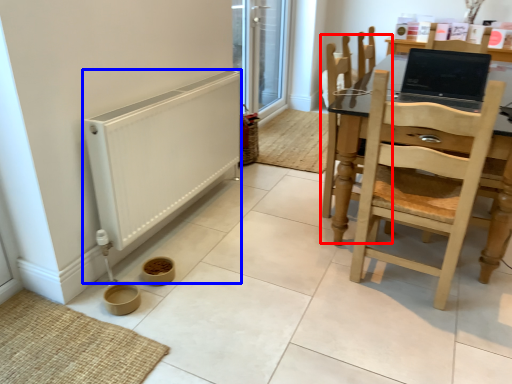
Question: Which object is closer to the camera taking this photo, chair (highlighted by a red box) or heater (highlighted by a blue box)?

Choices:
 (A) chair
 (B) heater

Answer: (B)